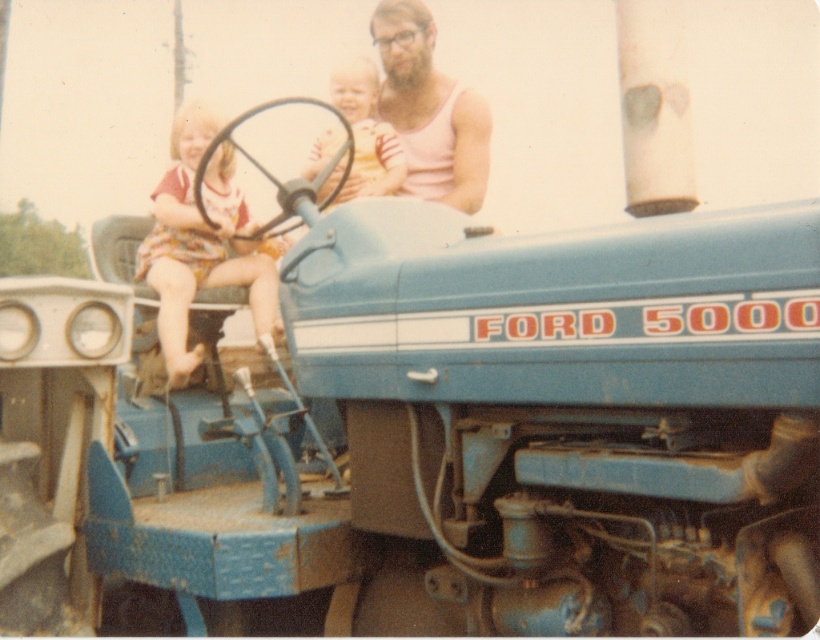
You are standing in front of the vintage Ford 5000 tractor scene. There is a point at coordinates point (233, 262) that you want to reach. If you can move 12 feet forward, will you be able to reach that point?

The point (233, 262) is 13.09 feet away from the camera. Since you can move 12 feet forward, you won not be able to reach it as you are still 1.09 feet short.

What is the color of the clothing worn by the child sitting at the position marked by the point coordinates (429,109)?

The point coordinates (429,109) are located on the pink tank top at upper center, so the clothing color is pink.

Looking at the vintage Ford 5000 tractor scene, where the floral dress at left and pink tank top at upper center are visible, which clothing item is positioned more to the left?

The floral dress at left is positioned more to the left than the pink tank top at upper center.